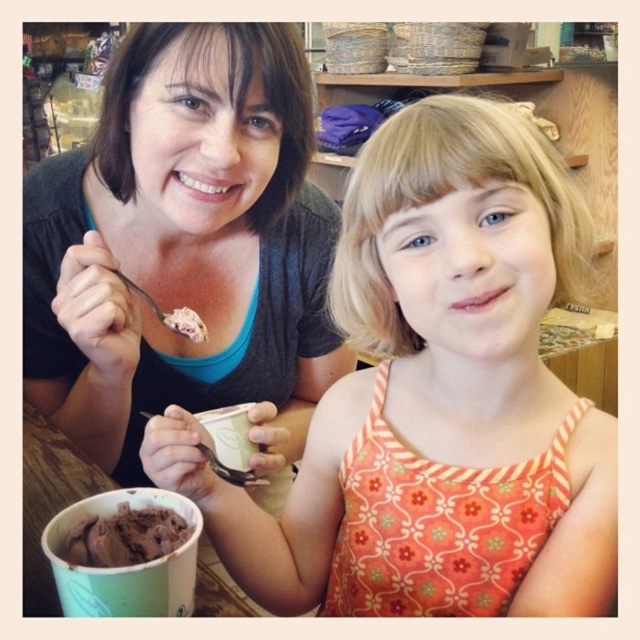
Looking at this image, you are trying to decide whether to place a small decorative item on the matte black shirt at upper left or the chocolate ice cream at lower left. Based on their positions, which one is higher and thus more suitable for placing an item without it falling off?

The matte black shirt at upper left is above the chocolate ice cream at lower left, so placing the item on the matte black shirt at upper left would be more suitable as it is higher and less likely to cause the item to fall off.

You are designing a photo frame for this scene. The frame has a horizontal divider that splits the image into two equal parts. The divider is placed exactly in the middle of the image. Which object from the scene, the matte black shirt at upper left or the chocolate ice cream at lower left, will be entirely above the divider?

The matte black shirt at upper left will be entirely above the divider because it is positioned at the upper part of the image, while the chocolate ice cream at lower left is located lower down and would be split by the divider.